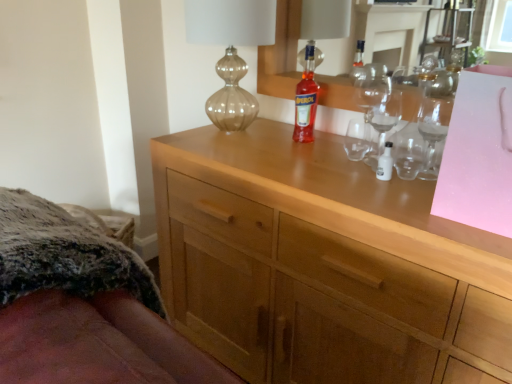
The image size is (512, 384). I want to click on free space in front of transparent glass wine glass at upper right, so click(x=404, y=187).